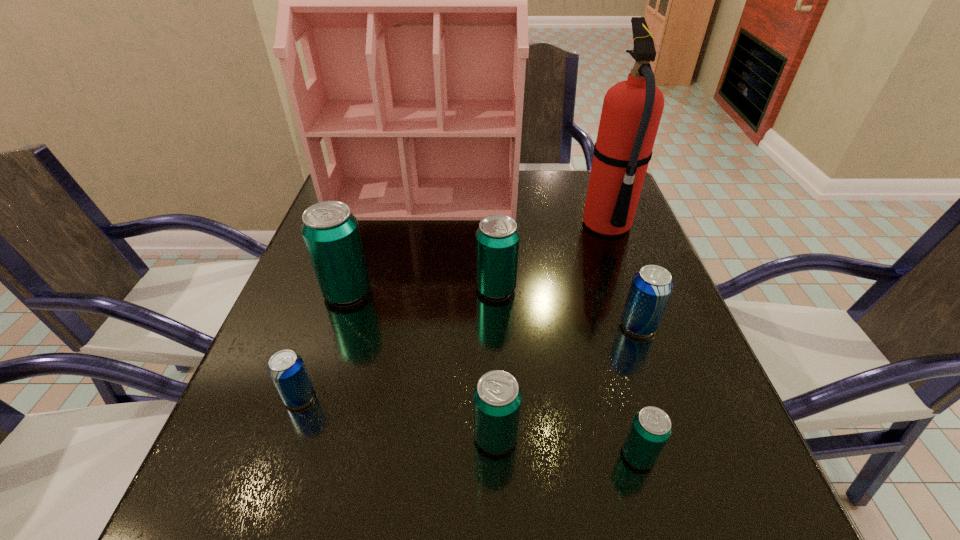
Where is `free space that satisfies the following two spatial constraints: 1. on the front-facing side of the dollhouse; 2. on the left side of the second smallest teal beer can`? This screenshot has width=960, height=540. free space that satisfies the following two spatial constraints: 1. on the front-facing side of the dollhouse; 2. on the left side of the second smallest teal beer can is located at coordinates (381, 436).

Find the location of a particular element. vacant region that satisfies the following two spatial constraints: 1. on the front-facing side of the second smallest teal beer can; 2. on the right side of the dollhouse is located at coordinates (381, 436).

Where is `vacant area that satisfies the following two spatial constraints: 1. on the front-facing side of the right blue beer can; 2. on the right side of the dollhouse`? vacant area that satisfies the following two spatial constraints: 1. on the front-facing side of the right blue beer can; 2. on the right side of the dollhouse is located at coordinates coord(401,325).

You are a GUI agent. You are given a task and a screenshot of the screen. Output one action in this format:
    pyautogui.click(x=<x>, y=<y>)
    Task: Click on the blank space that satisfies the following two spatial constraints: 1. at the nozzle of the red fire extinguisher; 2. on the front side of the fifth shortest beer can
    The width and height of the screenshot is (960, 540).
    Given the screenshot: What is the action you would take?
    pyautogui.click(x=631, y=288)

This screenshot has height=540, width=960. In order to click on vacant space that satisfies the following two spatial constraints: 1. on the front side of the rightmost teal beer can; 2. on the left side of the second biggest teal beer can in this screenshot , I will do `click(502, 455)`.